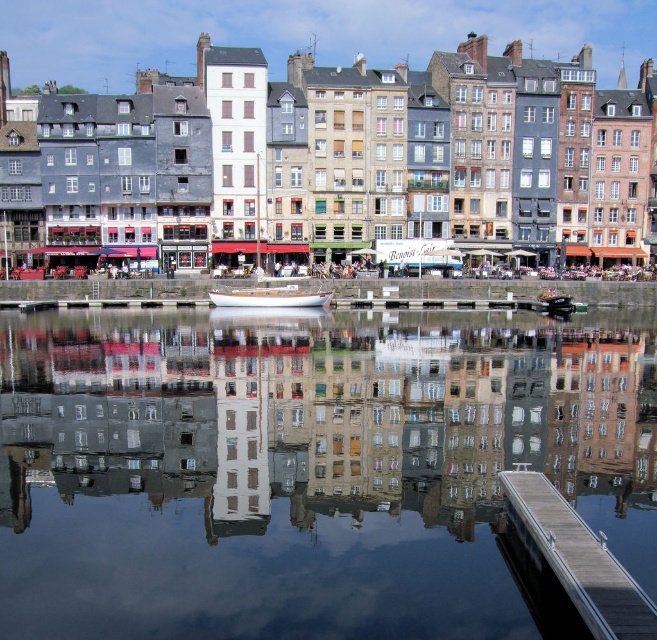
You are standing at the point marked as point (579, 561). Which structure are you currently on?

The point (579, 561) is on wooden dock at lower right, so you are currently on the wooden dock at lower right.

You are a photographer planning to capture the waterfront scene. You want to ensure both the white wood boat at center and the white wooden boat at center are clearly visible in your shot. Given that your camera has a fixed focal length, which boat should you prioritize positioning closer to the center of the frame to avoid cropping either of them?

You should prioritize positioning the white wooden boat at center closer to the center of the frame because the white wood boat at center is wider and may require more space to fit fully in the shot without cropping.